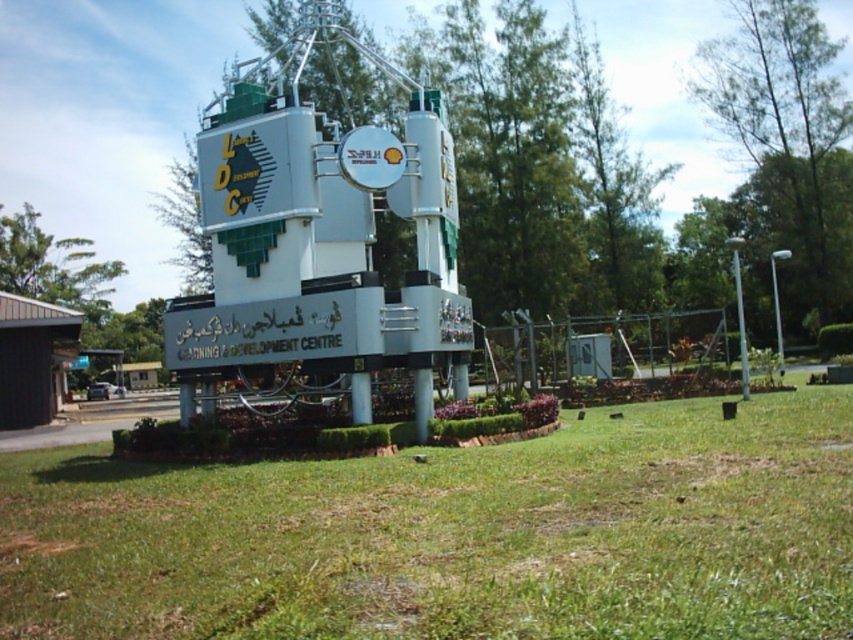
Is point (535, 573) farther from viewer compared to point (258, 113)?

No.

Does green grass at center have a lesser width compared to white metallic water tower at center?

Indeed, green grass at center has a lesser width compared to white metallic water tower at center.

Does point (86, 604) lie in front of point (171, 339)?

That is True.

Where is `green grass at center`? green grass at center is located at coordinates (453, 536).